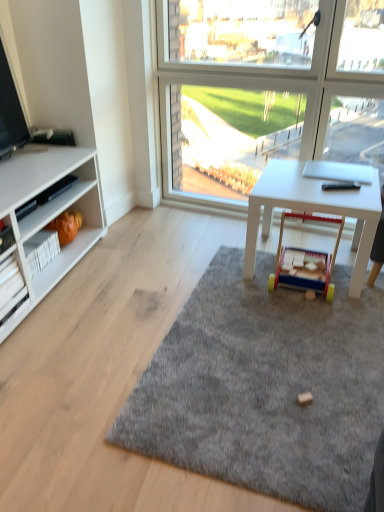
Question: Can you confirm if gray soft rug at center is taller than wooden toy at center, which is the 2th toy in left-to-right order?

Choices:
 (A) yes
 (B) no

Answer: (B)

Question: From a real-world perspective, is gray soft rug at center located higher than wooden toy at center, which is the 2th toy in left-to-right order?

Choices:
 (A) yes
 (B) no

Answer: (B)

Question: Is gray soft rug at center placed right next to wooden toy at center, which is the 2th toy in left-to-right order?

Choices:
 (A) yes
 (B) no

Answer: (B)

Question: Would you say wooden toy at center, which is the 2th toy in left-to-right order, is part of gray soft rug at center's contents?

Choices:
 (A) yes
 (B) no

Answer: (B)

Question: Considering the relative sizes of gray soft rug at center and wooden toy at center, acting as the second toy starting from the back, in the image provided, is gray soft rug at center thinner than wooden toy at center, acting as the second toy starting from the back,?

Choices:
 (A) yes
 (B) no

Answer: (B)

Question: Is there a large distance between gray soft rug at center and wooden toy at center, which ranks as the first toy in front-to-back order?

Choices:
 (A) yes
 (B) no

Answer: (B)

Question: Considering the relative positions of orange fabric toy at lower left, the 1th toy when ordered from left to right, and gray soft rug at center in the image provided, is orange fabric toy at lower left, the 1th toy when ordered from left to right, to the left of gray soft rug at center from the viewer's perspective?

Choices:
 (A) yes
 (B) no

Answer: (A)

Question: From a real-world perspective, is orange fabric toy at lower left, which is the 2th toy from front to back, over gray soft rug at center?

Choices:
 (A) no
 (B) yes

Answer: (B)

Question: From a real-world perspective, is orange fabric toy at lower left, the 1th toy viewed from the back, beneath gray soft rug at center?

Choices:
 (A) no
 (B) yes

Answer: (A)

Question: Does orange fabric toy at lower left, which is the 2th toy from front to back, have a greater width compared to gray soft rug at center?

Choices:
 (A) yes
 (B) no

Answer: (B)

Question: From the image's perspective, would you say orange fabric toy at lower left, the 1th toy viewed from the back, is positioned over gray soft rug at center?

Choices:
 (A) yes
 (B) no

Answer: (A)

Question: Is orange fabric toy at lower left, the 1th toy when ordered from left to right, with gray soft rug at center?

Choices:
 (A) no
 (B) yes

Answer: (A)

Question: Does white cardboard shelf at left have a smaller size compared to gray soft rug at center?

Choices:
 (A) yes
 (B) no

Answer: (A)